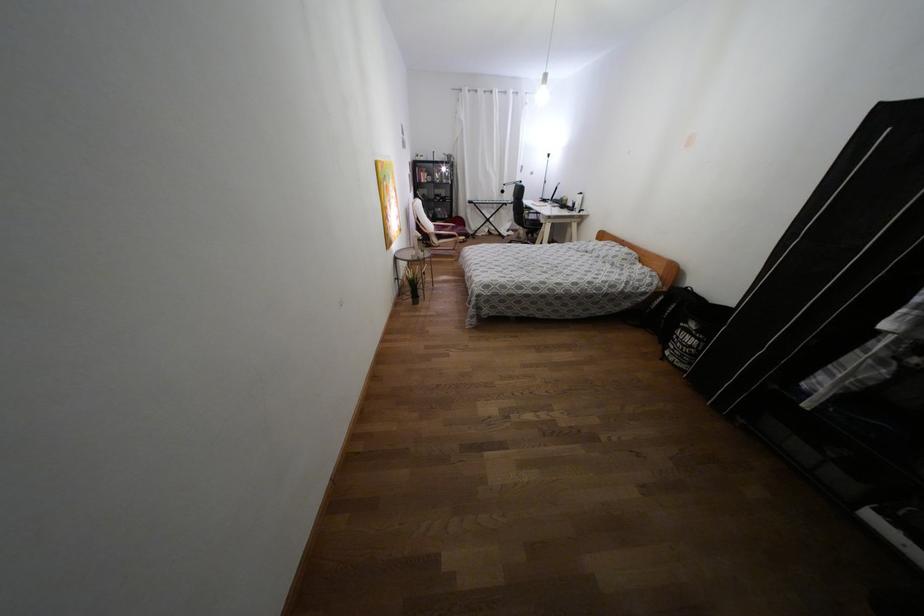
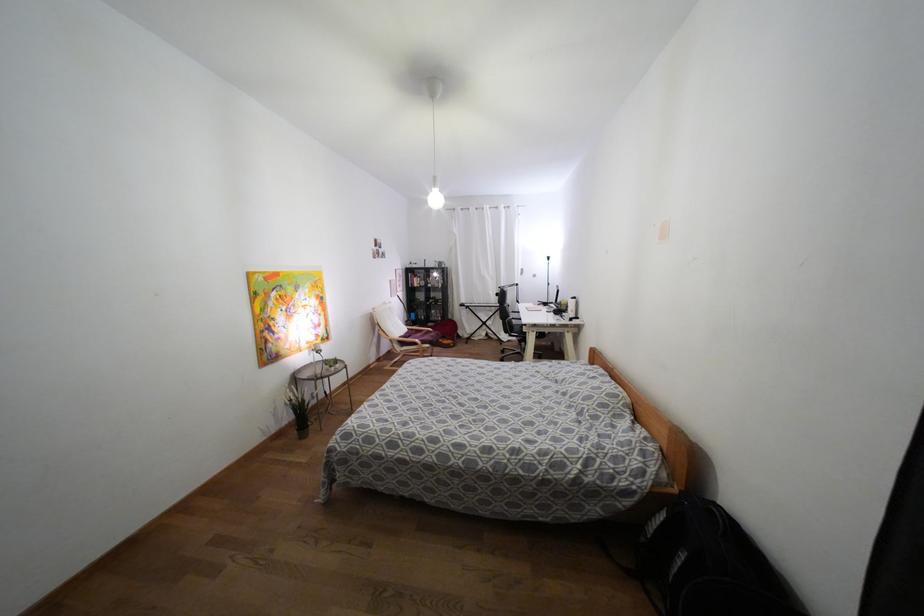
The images are taken continuously from a first-person perspective. In which direction are you moving?

The cameraman walked toward right, forward.